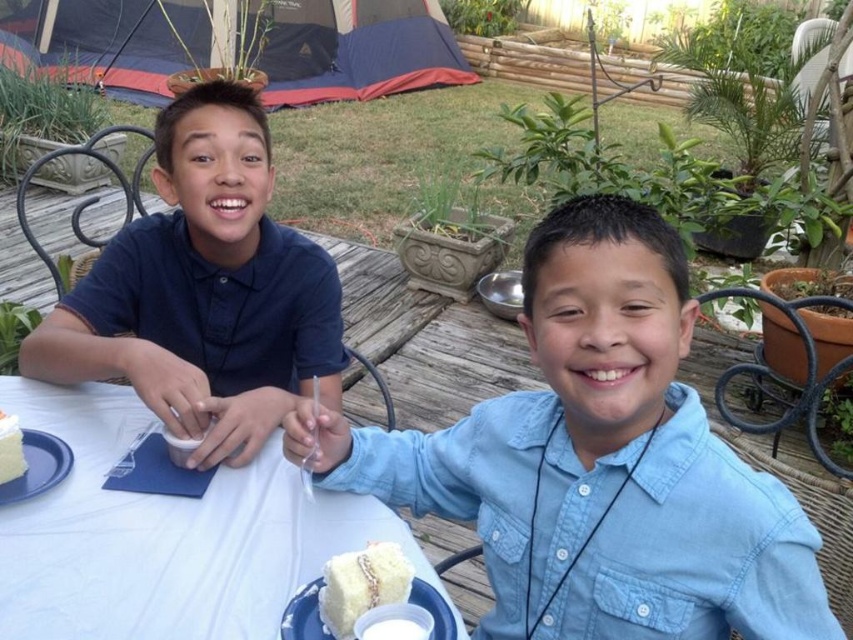
Does white matte plate at lower center appear on the left side of white fluffy cake at lower left?

No, white matte plate at lower center is not to the left of white fluffy cake at lower left.

Is white matte plate at lower center further to camera compared to white fluffy cake at lower left?

No, it is not.

What are the coordinates of `white matte plate at lower center` in the screenshot? It's located at (305, 614).

Between point (321, 540) and point (3, 474), which one is positioned in front?

Positioned in front is point (321, 540).

This screenshot has width=853, height=640. What do you see at coordinates (166, 536) in the screenshot? I see `white cloth table at center` at bounding box center [166, 536].

Identify the location of white cloth table at center. The width and height of the screenshot is (853, 640). (166, 536).

Is white fluffy cake at lower center thinner than white matte plate at lower center?

Correct, white fluffy cake at lower center's width is less than white matte plate at lower center's.

Is white fluffy cake at lower center closer to camera compared to white matte plate at lower center?

That is True.

Is point (363, 572) positioned in front of point (285, 620)?

Yes, point (363, 572) is closer to viewer.

Identify the location of white fluffy cake at lower center. Image resolution: width=853 pixels, height=640 pixels. (363, 584).